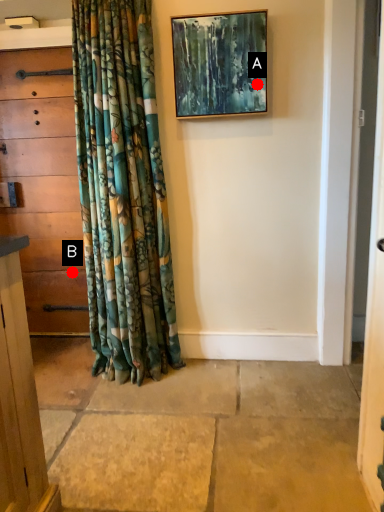
Question: Two points are circled on the image, labeled by A and B beside each circle. Which point is closer to the camera taking this photo?

Choices:
 (A) A is closer
 (B) B is closer

Answer: (A)